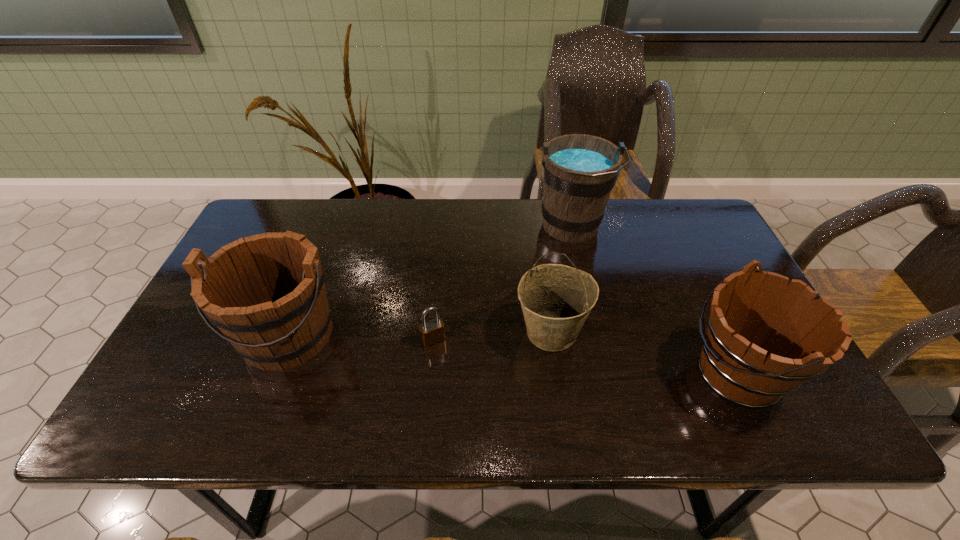
Where is `vacant region located on the back of the padlock`? This screenshot has height=540, width=960. vacant region located on the back of the padlock is located at coordinates (442, 248).

The image size is (960, 540). I want to click on object at the far edge, so click(579, 171).

The image size is (960, 540). Find the location of `object at the near edge`. object at the near edge is located at coordinates (765, 336).

Find the location of a particular element. This screenshot has height=540, width=960. object positioned at the left edge is located at coordinates (266, 293).

You are a GUI agent. You are given a task and a screenshot of the screen. Output one action in this format:
    pyautogui.click(x=<x>, y=<y>)
    Task: Click on the object that is at the right edge
    
    Given the screenshot: What is the action you would take?
    pyautogui.click(x=765, y=336)

The height and width of the screenshot is (540, 960). What are the coordinates of `object located at the near right corner` in the screenshot? It's located at [x=765, y=336].

In the image, there is a desktop. At what (x,y) coordinates should I click in order to perform the action: click on free space at the far edge. Please return your answer as a coordinate pair (x, y). The image size is (960, 540). Looking at the image, I should click on (622, 221).

Where is `vacant space at the near edge of the desktop`? Image resolution: width=960 pixels, height=540 pixels. vacant space at the near edge of the desktop is located at coordinates (660, 418).

Locate an element on the screen. free space at the left edge of the desktop is located at coordinates (173, 369).

Where is `free spot at the far left corner of the desktop`? Image resolution: width=960 pixels, height=540 pixels. free spot at the far left corner of the desktop is located at coordinates (252, 220).